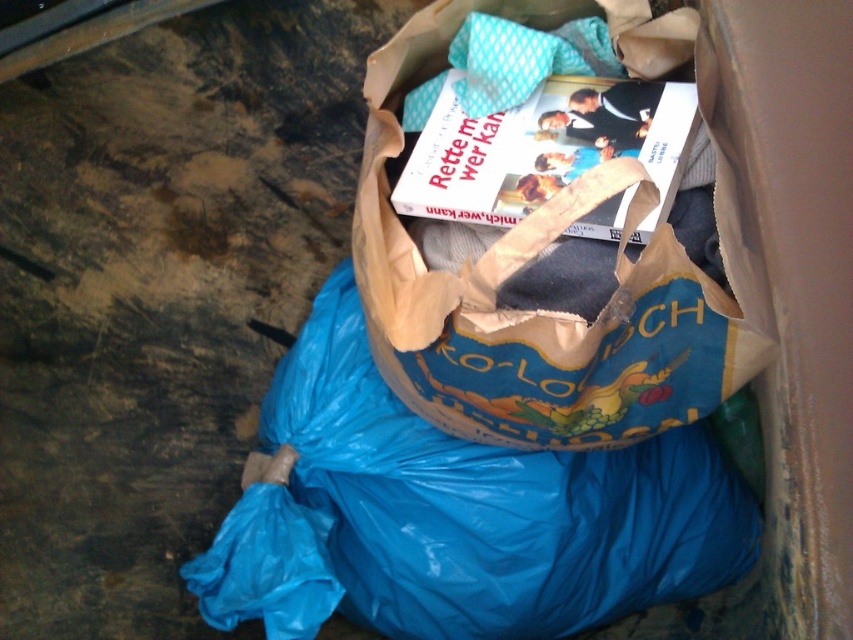
Question: Which point appears farthest from the camera in this image?

Choices:
 (A) (483, 189)
 (B) (764, 340)

Answer: (A)

Question: Is blue paper bag at center to the right of white paper book at center from the viewer's perspective?

Choices:
 (A) no
 (B) yes

Answer: (A)

Question: Is blue paper bag at center to the left of white paper book at center from the viewer's perspective?

Choices:
 (A) no
 (B) yes

Answer: (B)

Question: Is blue paper bag at center below white paper book at center?

Choices:
 (A) yes
 (B) no

Answer: (A)

Question: Which point is closer to the camera taking this photo?

Choices:
 (A) (474, 179)
 (B) (496, 348)

Answer: (B)